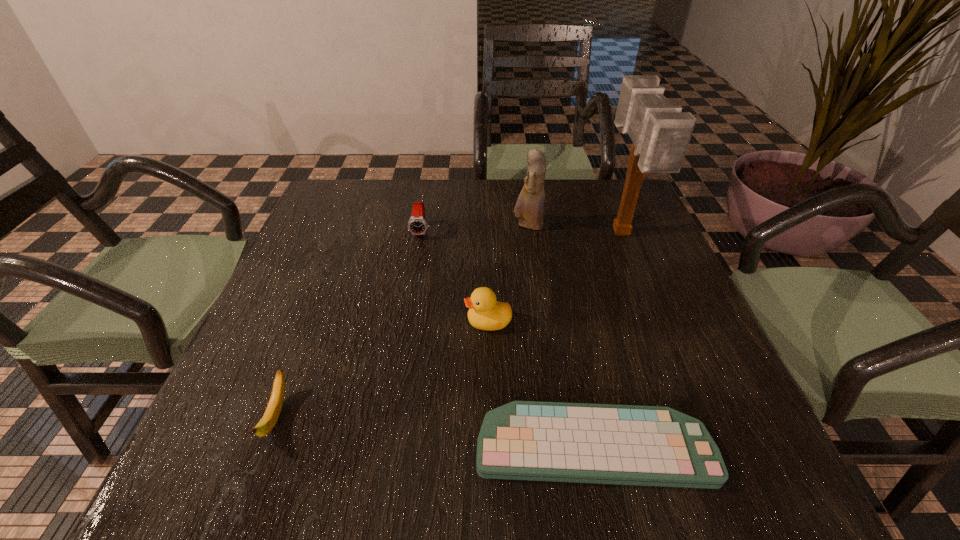
The width and height of the screenshot is (960, 540). I want to click on vacant region located on the front-facing side of the figurine, so click(x=396, y=226).

Locate an element on the screen. The width and height of the screenshot is (960, 540). vacant space positioned at the beak of the third nearest object is located at coordinates (436, 322).

This screenshot has width=960, height=540. Identify the location of free location located at the beak of the third nearest object. (378, 322).

I want to click on vacant space located at the beak of the third nearest object, so click(402, 322).

Where is `free location located 0.070m on the face of the fifth object from right to left`? free location located 0.070m on the face of the fifth object from right to left is located at coordinates (417, 258).

What are the coordinates of `vacant space located 0.050m at the stem of the banana` in the screenshot? It's located at (252, 483).

Where is `vacant space located on the left of the computer keyboard`? This screenshot has height=540, width=960. vacant space located on the left of the computer keyboard is located at coordinates (230, 446).

I want to click on mallet at the far edge, so click(660, 132).

Find the location of a particular element. figurine that is positioned at the far edge is located at coordinates (530, 204).

At what (x,y) coordinates should I click in order to perform the action: click on watch located at the far edge. Please return your answer as a coordinate pair (x, y). Looking at the image, I should click on (417, 225).